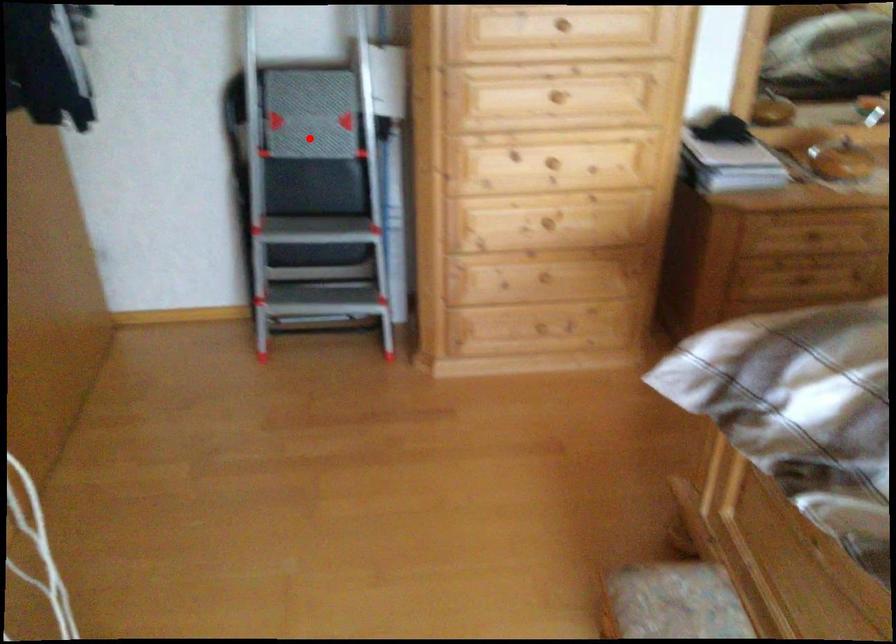
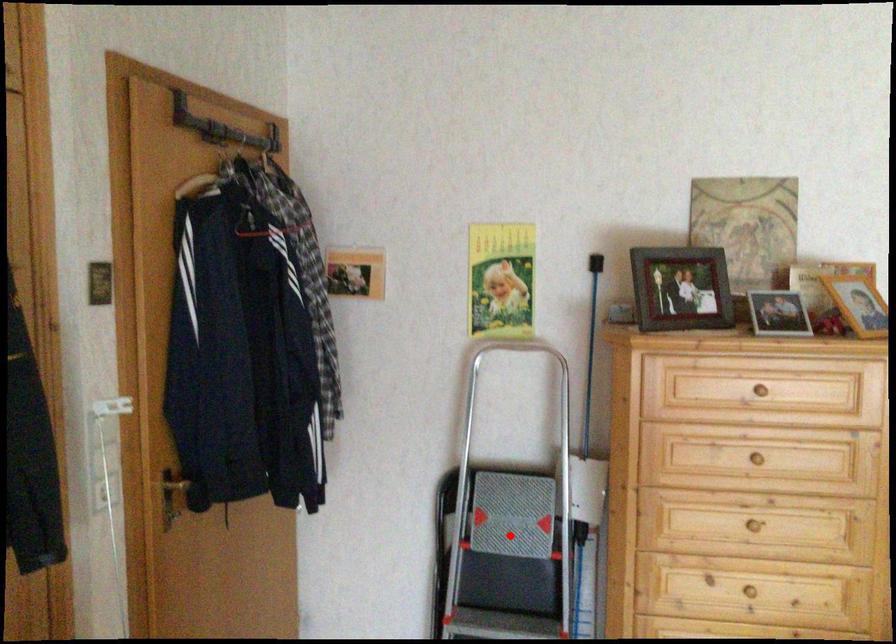
I am providing you with two images of the same scene from different viewpoints. A red point is marked on the first image and another point is marked on the second image. Are the points marked in image1 and image2 representing the same 3D position?

Yes